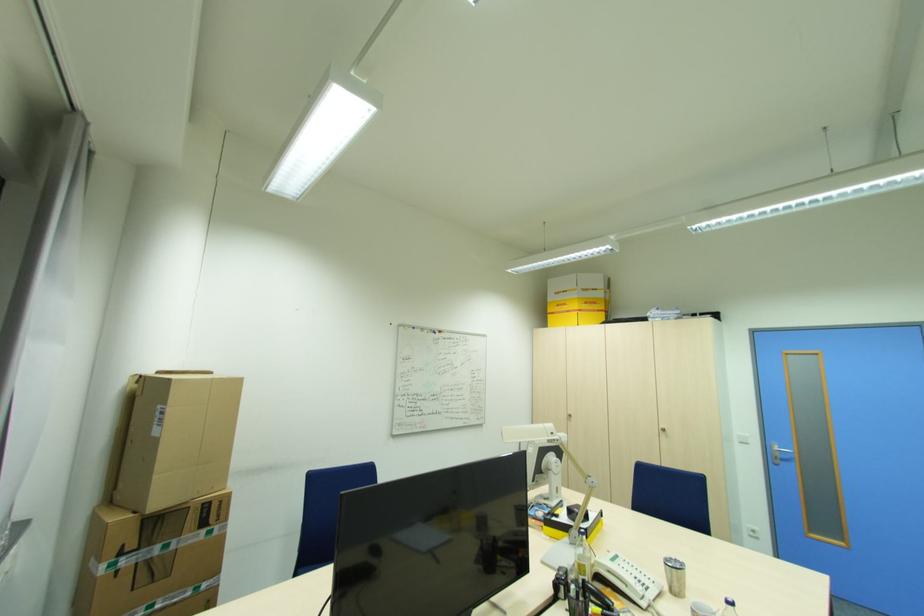
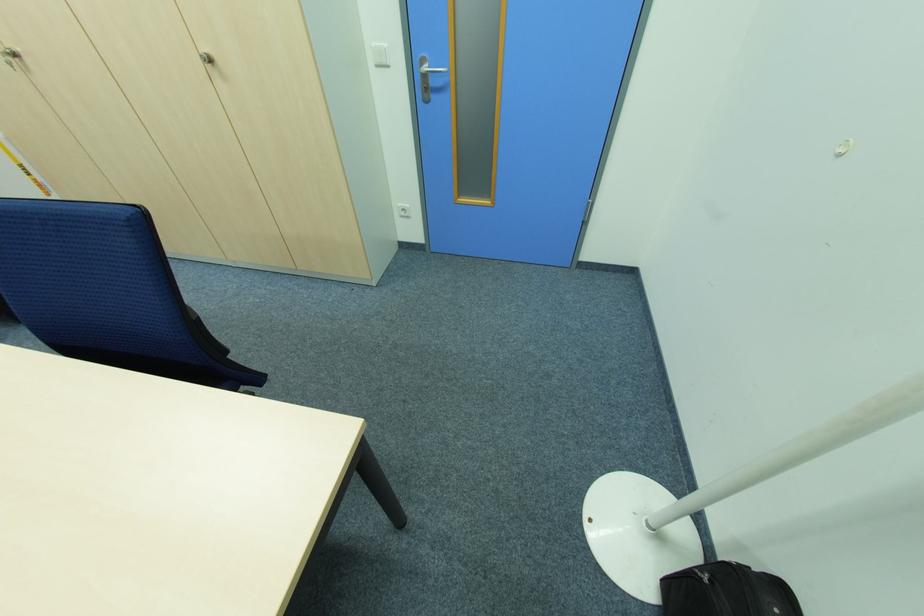
Where in the second image is the point corresponding to pixel 573 416 from the first image?

(18, 55)